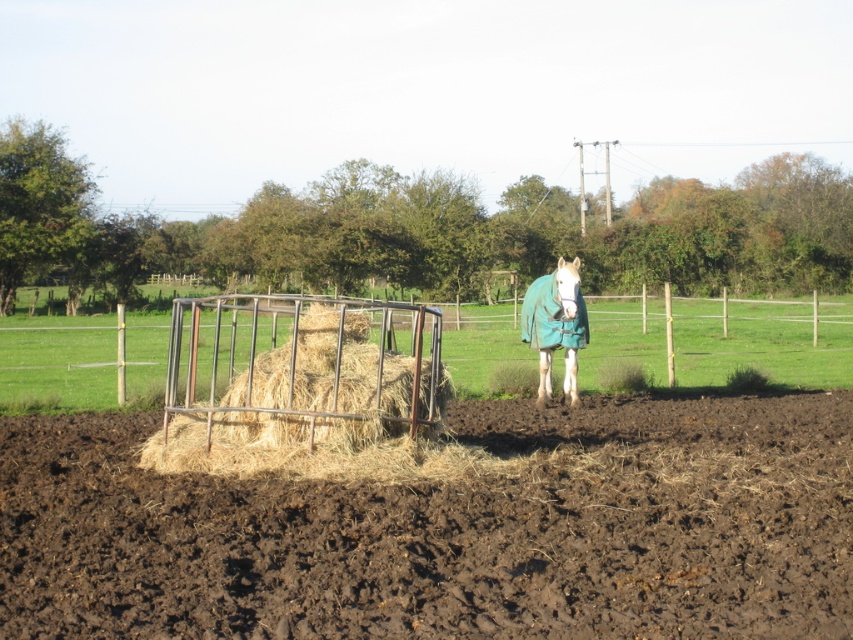
You are standing in the paddock and want to place a small fence post between the two points marked as point (474,576) and point (413,468). Which point should the fence post be closer to in order to be nearer to the camera?

The fence post should be closer to point (474,576) because it is nearer to the camera compared to point (413,468).

In the scene shown: You are a farmer checking the paddock. You notice the brown soil at lower center and the white fleece horse at center. Which object is located lower in the image?

The brown soil at lower center is positioned under the white fleece horse at center, so the brown soil at lower center is lower in the image.

You are a farmer checking the paddock. You notice the brown soil at lower center and the rusty metal hay feeder at center. Which object is positioned lower in the image?

The brown soil at lower center is located below the rusty metal hay feeder at center, so it is positioned lower in the image.